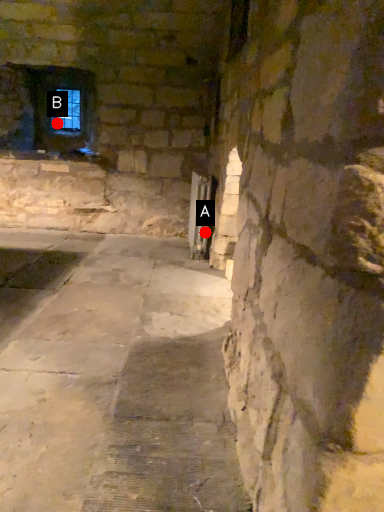
Question: Two points are circled on the image, labeled by A and B beside each circle. Which point is farther from the camera taking this photo?

Choices:
 (A) A is further
 (B) B is further

Answer: (B)